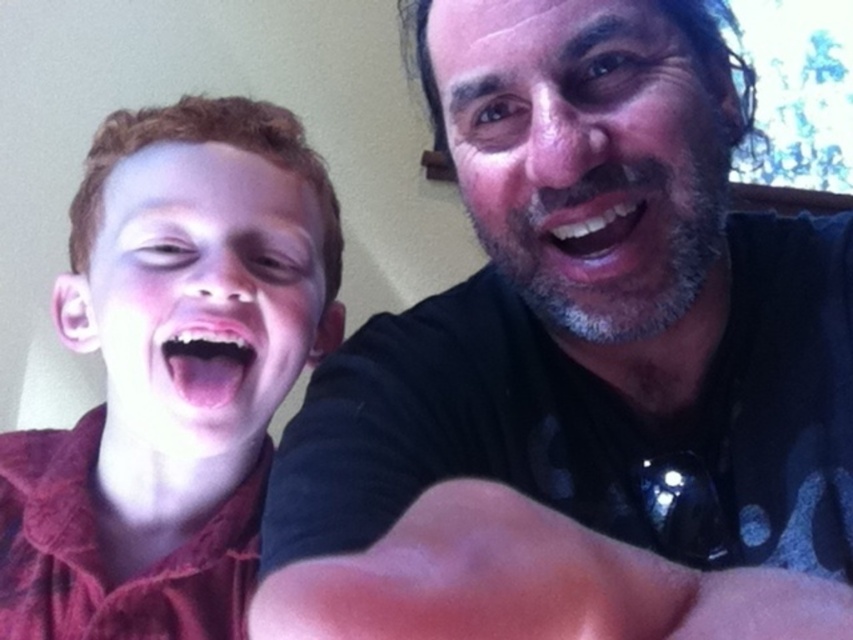
Question: Is matte red shirt at left below gray beard at upper right?

Choices:
 (A) no
 (B) yes

Answer: (B)

Question: Estimate the real-world distances between objects in this image. Which object is farther from the black matte shirt at upper right?

Choices:
 (A) pink flesh muscle at lower center
 (B) matte red shirt at left

Answer: (A)

Question: Which point appears closest to the camera in this image?

Choices:
 (A) (543, 221)
 (B) (595, 490)

Answer: (A)

Question: Which object is closer to the camera taking this photo?

Choices:
 (A) black matte shirt at upper right
 (B) gray beard at upper right
 (C) matte red shirt at left

Answer: (A)

Question: Is black matte shirt at upper right above matte red shirt at left?

Choices:
 (A) no
 (B) yes

Answer: (B)

Question: Observing the image, what is the correct spatial positioning of gray beard at upper right in reference to pink flesh muscle at lower center?

Choices:
 (A) below
 (B) above

Answer: (B)